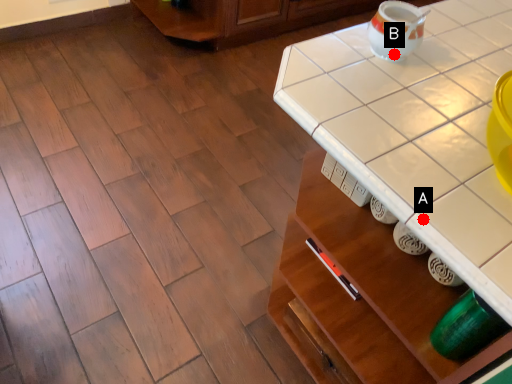
Question: Two points are circled on the image, labeled by A and B beside each circle. Which of the following is the farthest from the observer?

Choices:
 (A) A is further
 (B) B is further

Answer: (B)